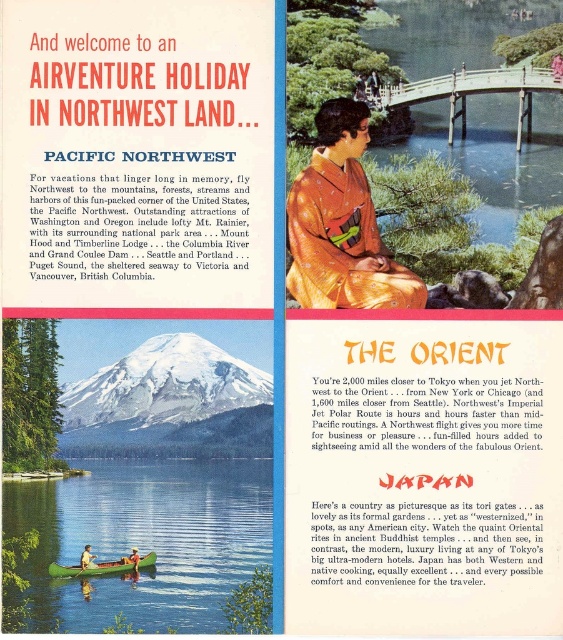
Image resolution: width=563 pixels, height=640 pixels. What do you see at coordinates (341, 224) in the screenshot? I see `orange silk kimono at center` at bounding box center [341, 224].

Is orange silk kimono at center wider than green matte canoe at lower left?

Correct, the width of orange silk kimono at center exceeds that of green matte canoe at lower left.

Is point (315, 225) farther from viewer compared to point (137, 560)?

That is True.

Where is `orange silk kimono at center`? The width and height of the screenshot is (563, 640). orange silk kimono at center is located at coordinates (341, 224).

Who is positioned more to the right, green smooth water at lower left or green matte canoe at lower left?

green smooth water at lower left is more to the right.

Between point (252, 476) and point (126, 561), which one is positioned behind?

Point (252, 476)

In order to click on green smooth water at lower left in this screenshot , I will do `click(145, 540)`.

Does green smooth water at lower left appear on the left side of orange silk kimono at center?

Indeed, green smooth water at lower left is positioned on the left side of orange silk kimono at center.

Which of these two, green smooth water at lower left or orange silk kimono at center, stands shorter?

green smooth water at lower left

What do you see at coordinates (145, 540) in the screenshot? I see `green smooth water at lower left` at bounding box center [145, 540].

Image resolution: width=563 pixels, height=640 pixels. I want to click on green smooth water at lower left, so click(x=145, y=540).